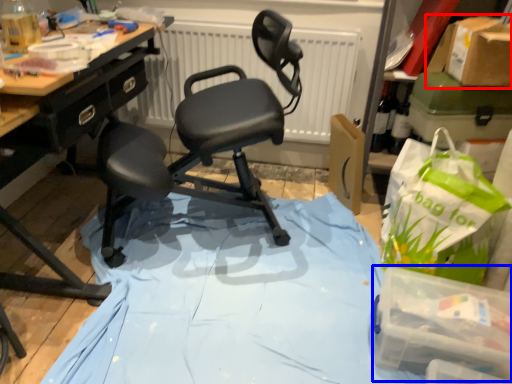
Question: Among these objects, which one is nearest to the camera, cardboard box (highlighted by a red box) or box (highlighted by a blue box)?

Choices:
 (A) cardboard box
 (B) box

Answer: (B)